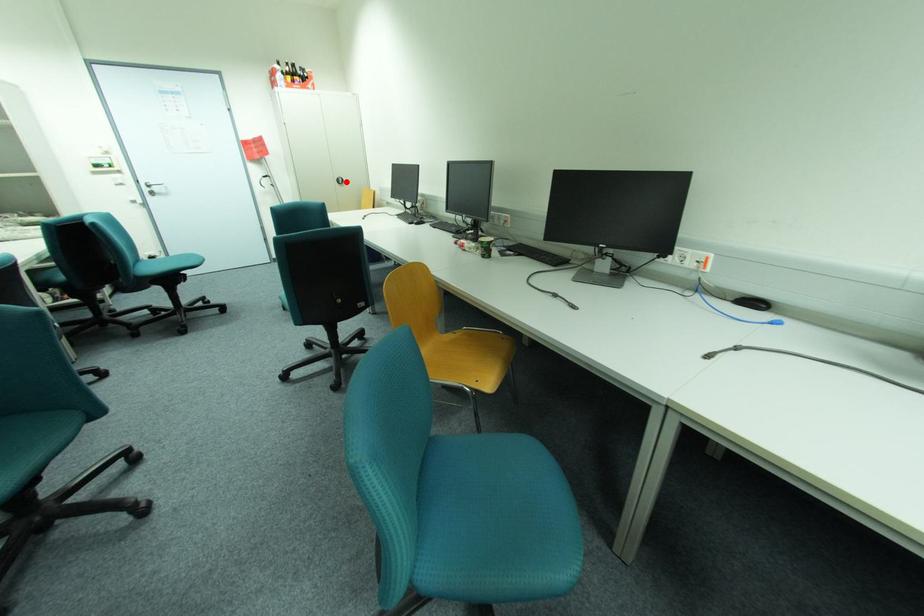
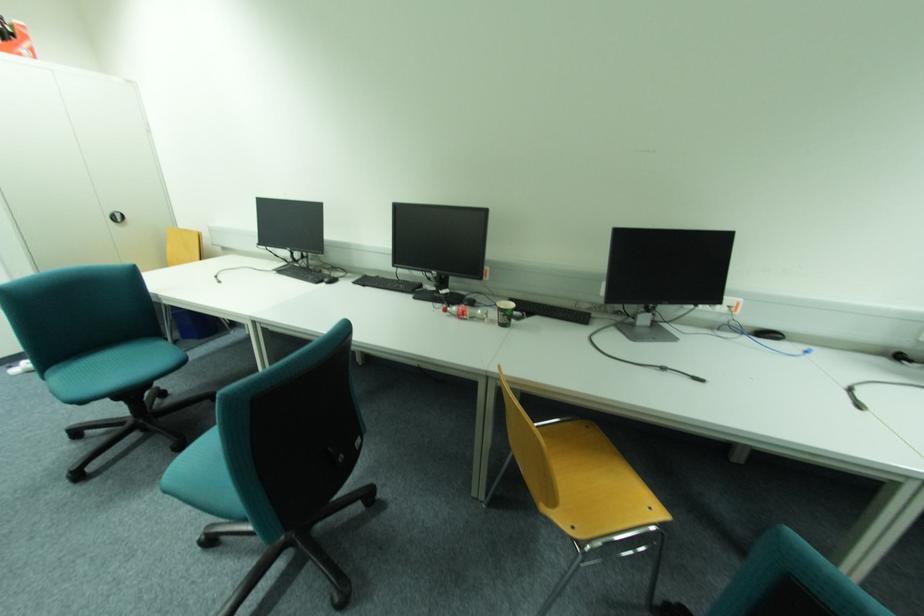
The point at the highlighted location is marked in the first image. Where is the corresponding point in the second image?

(126, 219)